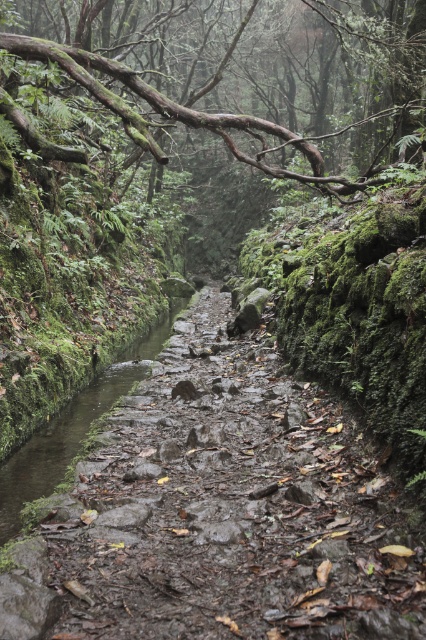
Based on the photo, you are a hiker trying to cross the narrow pathway in the forest. You notice a brown rough branch at upper center and a muddy stone stream at center. Which object is higher in elevation?

The brown rough branch at upper center is taller than the muddy stone stream at center, so the brown rough branch at upper center is higher in elevation.

You are a hiker navigating the narrow forest path. You see the brown rough branch at upper center and the muddy stone stream at center. Which object is closer to you as you walk along the path?

The brown rough branch at upper center is closer to you because it is in front of the muddy stone stream at center, which is positioned behind it.

You are a hiker carrying a backpack weighing 15 kilograms. You need to cross the muddy stone stream at center. The brown rough branch at upper center is 12.90 meters away. Can you safely walk from the branch to the stream without slipping?

The brown rough branch at upper center is 12.90 meters from the muddy stone stream at center. Since the distance is over 10 meters, it might be challenging to walk that far on the slippery path without slipping. Therefore, it is not safe to attempt the walk from the branch to the stream.